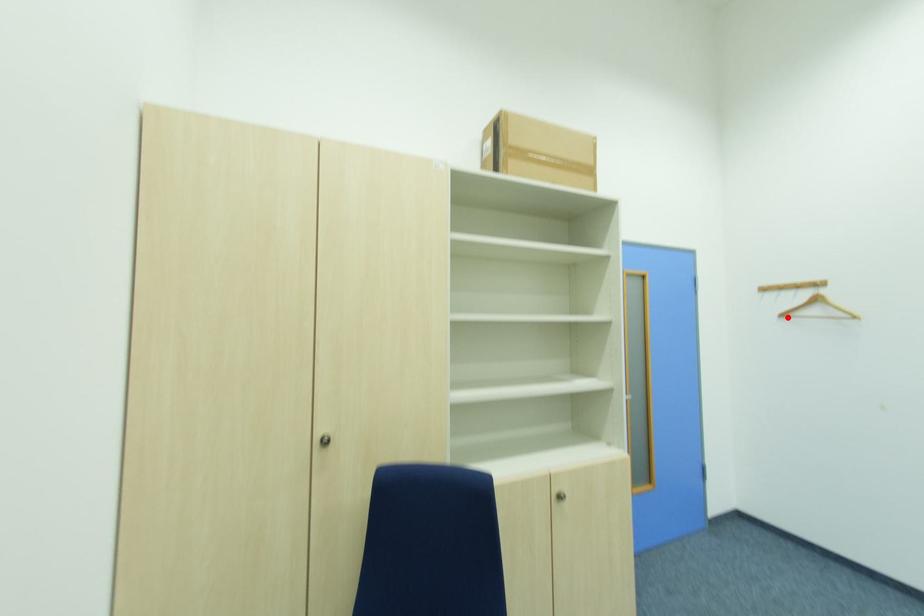
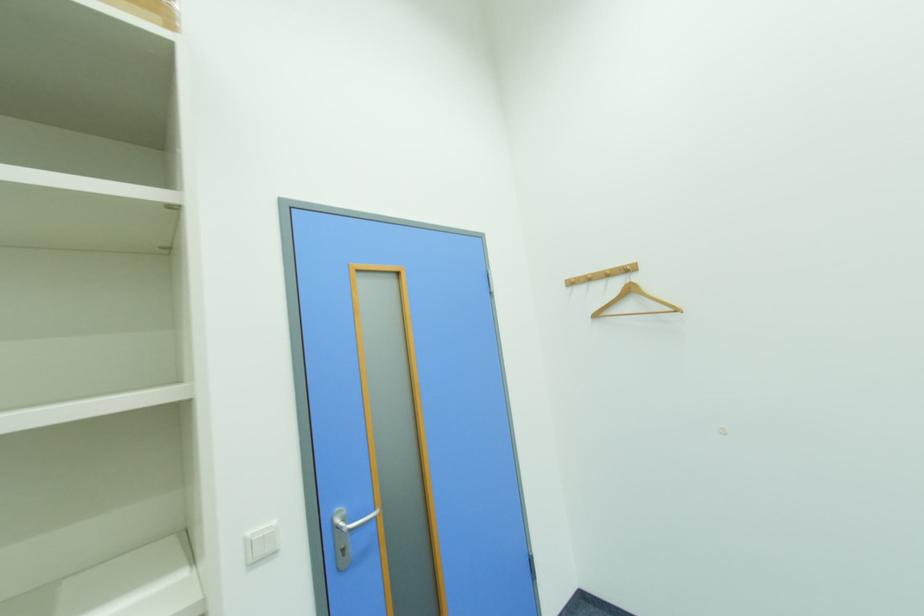
In the second image, find the point that corresponds to the highlighted location in the first image.

(601, 317)